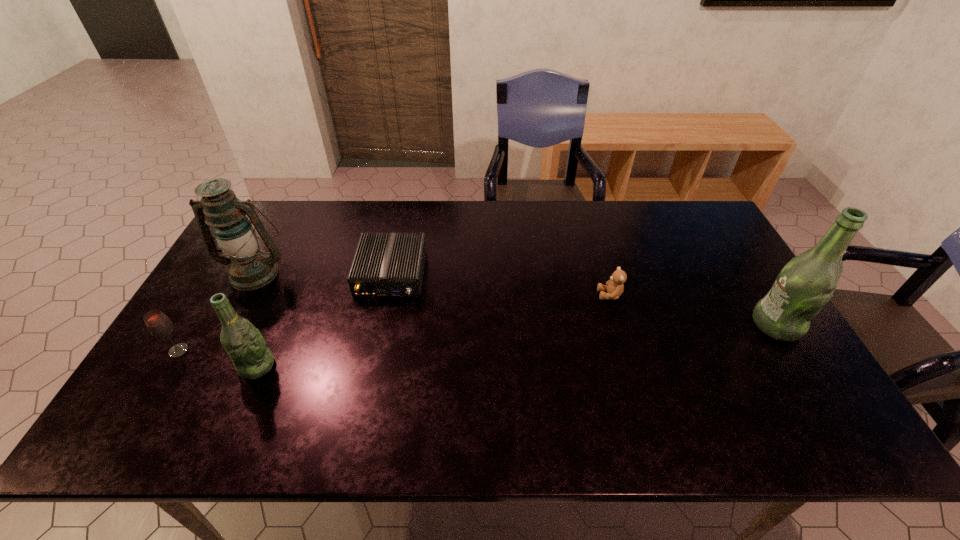
I want to click on blank region between the fifth tallest object and the fourth tallest object, so click(395, 323).

Locate an element on the screen. free space between the fifth shortest object and the router is located at coordinates (324, 273).

Identify the location of vacant area that lies between the shortest object and the fourth tallest object. (285, 312).

Locate an element on the screen. vacant point located between the fourth shortest object and the second tallest object is located at coordinates (256, 319).

Locate an element on the screen. This screenshot has height=540, width=960. vacant space in between the rightmost object and the third shortest object is located at coordinates (478, 338).

Where is `unoccupied area between the rightmost object and the fifth object from left to right`? Image resolution: width=960 pixels, height=540 pixels. unoccupied area between the rightmost object and the fifth object from left to right is located at coordinates (693, 309).

Identify the location of free space between the third object from right to left and the oil lamp. (324, 273).

Locate an element on the screen. free point between the oil lamp and the farther beer bottle is located at coordinates (516, 299).

Point out which object is positioned as the nearest to the third object from right to left. Please provide its 2D coordinates. Your answer should be formatted as a tuple, i.e. [(x, y)], where the tuple contains the x and y coordinates of a point satisfying the conditions above.

[(249, 268)]

Choose which object is the third nearest neighbor to the glass drink container. Please provide its 2D coordinates. Your answer should be formatted as a tuple, i.e. [(x, y)], where the tuple contains the x and y coordinates of a point satisfying the conditions above.

[(392, 265)]